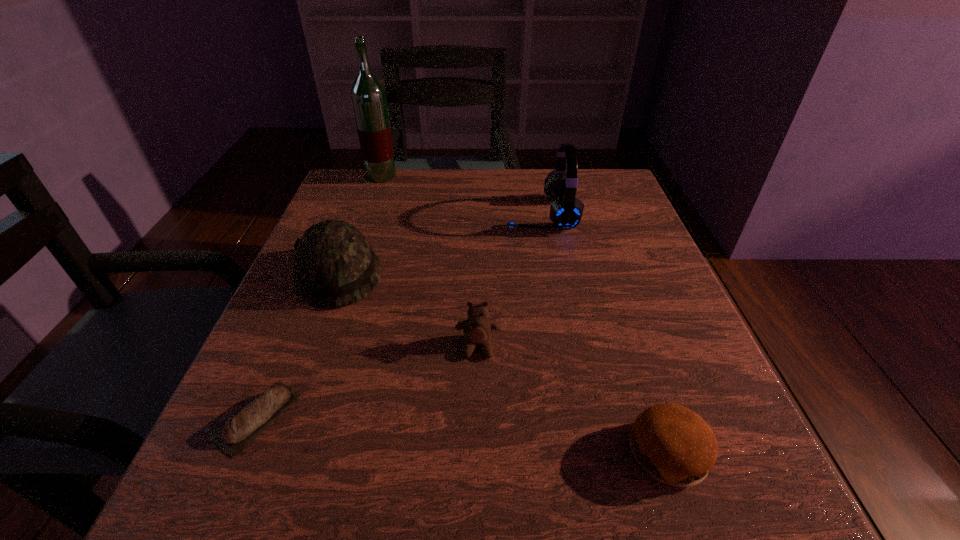
Identify the location of free space between the third shortest object and the farthest object. (429, 261).

Locate an element on the screen. This screenshot has width=960, height=540. free space that is in between the fourth tallest object and the liquor is located at coordinates pos(429,261).

Locate an element on the screen. This screenshot has height=540, width=960. free space between the pita bread and the headwear is located at coordinates (299, 346).

What are the coordinates of `empty space between the shortest object and the fourth nearest object` in the screenshot? It's located at (299, 346).

Identify the location of the fifth closest object to the headwear. (672, 443).

The image size is (960, 540). I want to click on the second closest object relative to the fifth shortest object, so click(x=477, y=329).

Locate an element on the screen. This screenshot has width=960, height=540. vacant position in the image that satisfies the following two spatial constraints: 1. on the ear cushions of the fifth nearest object; 2. on the front side of the shortest object is located at coordinates (579, 417).

The width and height of the screenshot is (960, 540). Identify the location of free space that satisfies the following two spatial constraints: 1. on the back side of the shortest object; 2. on the left side of the tallest object. (361, 176).

This screenshot has height=540, width=960. I want to click on vacant area that satisfies the following two spatial constraints: 1. on the ear cushions of the fifth shortest object; 2. on the left side of the hamburger, so click(x=586, y=453).